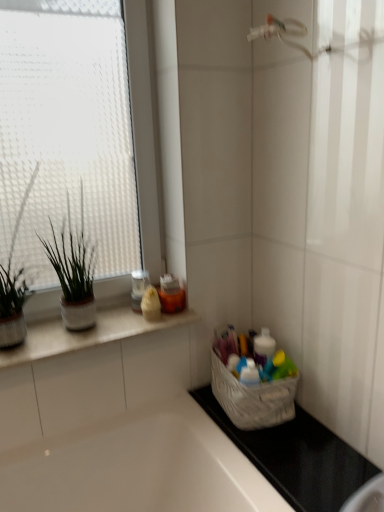
You are a GUI agent. You are given a task and a screenshot of the screen. Output one action in this format:
    pyautogui.click(x=<x>, y=<y>)
    Task: Click on the vacant point to the right of green matte plant at left, which ranks as the 1th houseplant in right-to-left order
    The height and width of the screenshot is (512, 384).
    Given the screenshot: What is the action you would take?
    pyautogui.click(x=119, y=320)